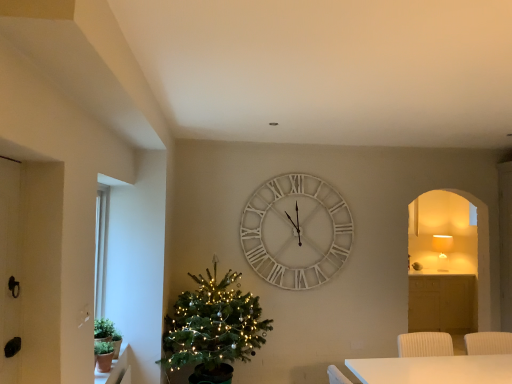
This screenshot has width=512, height=384. What do you see at coordinates (116, 371) in the screenshot?
I see `terracotta clay pot at lower left` at bounding box center [116, 371].

The height and width of the screenshot is (384, 512). Describe the element at coordinates (106, 337) in the screenshot. I see `green matte plant at lower left` at that location.

Measure the distance between point [441,246] and camera.

A distance of 6.03 meters exists between point [441,246] and camera.

Find the location of `matte white lampshade at right`. matte white lampshade at right is located at coordinates (442, 250).

The width and height of the screenshot is (512, 384). Describe the element at coordinates (9, 263) in the screenshot. I see `black matte glass door at left` at that location.

Where is `terracotta clay pot at lower left`? The image size is (512, 384). terracotta clay pot at lower left is located at coordinates (116, 371).

Can you confirm if green matte plant at lower left is smaller than matte white lampshade at right?

Yes.

Which is in front, green matte plant at lower left or matte white lampshade at right?

green matte plant at lower left is more forward.

Does green matte plant at lower left appear on the left side of matte white lampshade at right?

Correct, you'll find green matte plant at lower left to the left of matte white lampshade at right.

Does point (103, 342) come behind point (432, 243)?

No, it is in front of (432, 243).

Considering the sizes of objects matte white lampshade at right and terracotta clay pot at lower left in the image provided, who is smaller, matte white lampshade at right or terracotta clay pot at lower left?

Smaller between the two is terracotta clay pot at lower left.

Is terracotta clay pot at lower left completely or partially inside matte white lampshade at right?

Actually, terracotta clay pot at lower left is outside matte white lampshade at right.

Is the position of matte white lampshade at right less distant than that of terracotta clay pot at lower left?

No, the depth of matte white lampshade at right is greater than that of terracotta clay pot at lower left.

How many degrees apart are the facing directions of white wooden clock at center and green matte christmas tree at left?

They differ by 1.63 degrees in their facing directions.

From the image's perspective, which one is positioned lower, white wooden clock at center or green matte christmas tree at left?

green matte christmas tree at left appears lower in the image.

Considering the sizes of white wooden clock at center and green matte christmas tree at left in the image, is white wooden clock at center taller or shorter than green matte christmas tree at left?

In the image, white wooden clock at center appears to be shorter than green matte christmas tree at left.

Between white wooden clock at center and green matte christmas tree at left, which one appears on the right side from the viewer's perspective?

Positioned to the right is white wooden clock at center.

Are green matte plant at lower left and black matte glass door at left far apart?

Yes, green matte plant at lower left and black matte glass door at left are quite far apart.

Does point (106, 320) come in front of point (11, 161)?

No, it is behind (11, 161).

Which object is thinner, green matte plant at lower left or black matte glass door at left?

Thinner between the two is black matte glass door at left.

Which object is further away from the camera taking this photo, green matte plant at lower left or black matte glass door at left?

Positioned behind is green matte plant at lower left.

Is matte white lampshade at right turned away from white wooden clock at center?

No, matte white lampshade at right is not facing away from white wooden clock at center.

Is matte white lampshade at right not inside white wooden clock at center?

That's correct, matte white lampshade at right is outside of white wooden clock at center.

At what (x,y) coordinates should I click in order to perform the action: click on lamp lying below the white wooden clock at center (from the image's perspective). Please return your answer as a coordinate pair (x, y). Image resolution: width=512 pixels, height=384 pixels. Looking at the image, I should click on (442, 250).

Does point (446, 252) lie behind point (302, 209)?

Yes.

Does terracotta clay pot at lower left touch green matte christmas tree at left?

No, terracotta clay pot at lower left is not in contact with green matte christmas tree at left.

In the scene shown: Does terracotta clay pot at lower left lie in front of green matte christmas tree at left?

Yes.

In the scene shown: Can you tell me how much terracotta clay pot at lower left and green matte christmas tree at left differ in facing direction?

The angle between the facing direction of terracotta clay pot at lower left and the facing direction of green matte christmas tree at left is 91.6 degrees.

You are a GUI agent. You are given a task and a screenshot of the screen. Output one action in this format:
    pyautogui.click(x=<x>, y=<y>)
    Task: Click on the christmas tree above the terracotta clay pot at lower left (from the image's perspective)
    This screenshot has height=384, width=512.
    Given the screenshot: What is the action you would take?
    pyautogui.click(x=213, y=329)

Does point (95, 371) come behind point (276, 186)?

No, (95, 371) is in front of (276, 186).

Consider the image. From a real-world perspective, which is physically above, terracotta clay pot at lower left or white wooden clock at center?

white wooden clock at center, from a real-world perspective.

From the image's perspective, is terracotta clay pot at lower left located beneath white wooden clock at center?

Correct, terracotta clay pot at lower left appears lower than white wooden clock at center in the image.

Does terracotta clay pot at lower left appear on the right side of white wooden clock at center?

No.

What are the coordinates of `lamp located above the green matte plant at lower left (from a real-world perspective)` in the screenshot? It's located at (442, 250).

Where is `lamp on the right of terracotta clay pot at lower left`? The image size is (512, 384). lamp on the right of terracotta clay pot at lower left is located at coordinates (442, 250).

Considering their positions, is green matte christmas tree at left positioned closer to black matte glass door at left than white wooden clock at center?

green matte christmas tree at left lies closer to black matte glass door at left than the other object.

Consider the image. Based on their spatial positions, is black matte glass door at left or green matte christmas tree at left further from white wooden clock at center?

Based on the image, black matte glass door at left appears to be further to white wooden clock at center.

When comparing their distances from terracotta clay pot at lower left, does white wooden clock at center or green matte plant at lower left seem closer?

green matte plant at lower left is closer to terracotta clay pot at lower left.

Based on their spatial positions, is black matte glass door at left or green matte christmas tree at left closer to terracotta clay pot at lower left?

The object closer to terracotta clay pot at lower left is green matte christmas tree at left.

Looking at the image, which one is located further to green matte christmas tree at left, white wooden clock at center or green matte plant at lower left?

Based on the image, white wooden clock at center appears to be further to green matte christmas tree at left.

Estimate the real-world distances between objects in this image. Which object is closer to black matte glass door at left, terracotta clay pot at lower left or white wooden clock at center?

terracotta clay pot at lower left is closer to black matte glass door at left.

From the image, which object appears to be farther from white wooden clock at center, terracotta clay pot at lower left or green matte plant at lower left?

green matte plant at lower left is further to white wooden clock at center.

Looking at the image, which one is located further to green matte christmas tree at left, black matte glass door at left or white wooden clock at center?

black matte glass door at left is further to green matte christmas tree at left.

This screenshot has height=384, width=512. Identify the location of christmas tree located between green matte plant at lower left and white wooden clock at center in the left-right direction. (213, 329).

Find the location of a particular element. The height and width of the screenshot is (384, 512). window sill located between green matte plant at lower left and green matte christmas tree at left in the left-right direction is located at coordinates (116, 371).

Find the location of a particular element. This screenshot has width=512, height=384. window sill between black matte glass door at left and white wooden clock at center along the z-axis is located at coordinates (116, 371).

In order to click on window sill between black matte glass door at left and matte white lampshade at right along the z-axis in this screenshot , I will do point(116,371).